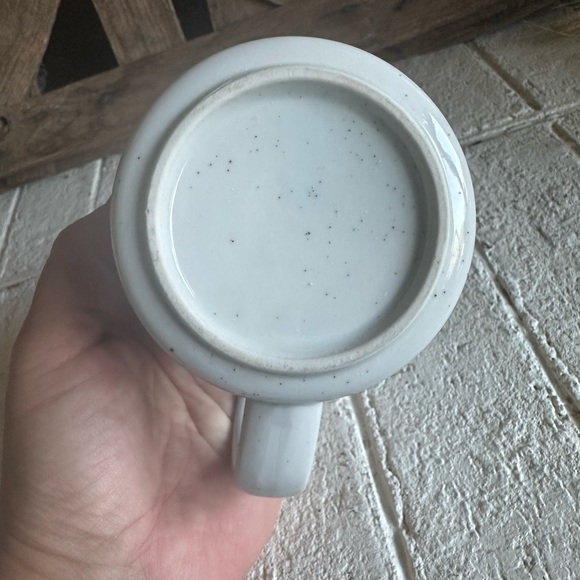
Identify the location of ceramic. The height and width of the screenshot is (580, 580). pyautogui.click(x=267, y=309).